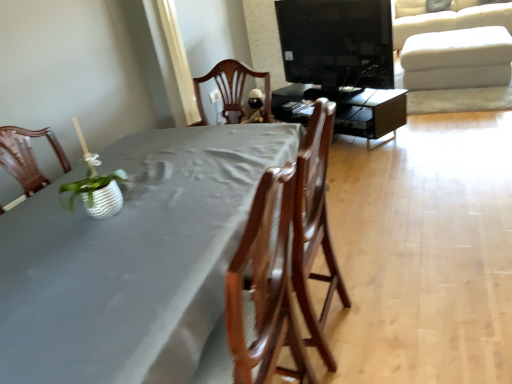
This screenshot has height=384, width=512. Describe the element at coordinates (132, 259) in the screenshot. I see `gray fabric table at center, the second table when ordered from right to left` at that location.

Describe the element at coordinates (345, 60) in the screenshot. I see `black glossy tv at upper center` at that location.

Locate an element on the screen. white textured pot at left is located at coordinates (96, 190).

Between white textured pot at left and matte black tv stand at center, the 2th table from the front, which one has less height?

white textured pot at left.

Locate an element on the screen. The width and height of the screenshot is (512, 384). table behind the white textured pot at left is located at coordinates (371, 113).

Considering the relative sizes of white textured pot at left and matte black tv stand at center, which appears as the first table when viewed from the top, in the image provided, is white textured pot at left wider than matte black tv stand at center, which appears as the first table when viewed from the top,?

In fact, white textured pot at left might be narrower than matte black tv stand at center, which appears as the first table when viewed from the top.

Would you say white textured pot at left is to the left or to the right of matte black tv stand at center, the 2th table from the front, in the picture?

From the image, it's evident that white textured pot at left is to the left of matte black tv stand at center, the 2th table from the front.

Is gray fabric table at center, the second table when ordered from right to left, with black glossy tv at upper center?

No, gray fabric table at center, the second table when ordered from right to left, is not making contact with black glossy tv at upper center.

I want to click on entertainment center above the gray fabric table at center, which is the 1th table in front-to-back order (from a real-world perspective), so click(x=345, y=60).

Which point is more distant from viewer, (x=147, y=375) or (x=326, y=42)?

The point (x=326, y=42) is more distant.

Can you confirm if wooden chair at center is positioned to the right of black glossy tv at upper center?

In fact, wooden chair at center is to the left of black glossy tv at upper center.

Where is `entertainment center behind the wooden chair at center`? entertainment center behind the wooden chair at center is located at coordinates (345, 60).

Is wooden chair at center shorter than black glossy tv at upper center?

In fact, wooden chair at center may be taller than black glossy tv at upper center.

Does point (237, 357) appear closer or farther from the camera than point (351, 114)?

Point (237, 357) appears to be closer to the viewer than point (351, 114).

Is black glossy tv at upper center positioned far away from gray fabric table at center, the first table positioned from the left?

Yes.

Is black glossy tv at upper center bigger or smaller than gray fabric table at center, the first table positioned from the left?

Considering their sizes, black glossy tv at upper center takes up less space than gray fabric table at center, the first table positioned from the left.

Which object is positioned more to the right, black glossy tv at upper center or gray fabric table at center, the first table positioned from the left?

black glossy tv at upper center is more to the right.

How much distance is there between black glossy tv at upper center and gray fabric table at center, which ranks as the 1th table in bottom-to-top order?

The distance of black glossy tv at upper center from gray fabric table at center, which ranks as the 1th table in bottom-to-top order, is 2.14 meters.

Is the depth of gray fabric table at center, the first table positioned from the left, greater than that of matte black tv stand at center, marked as the 2th table in a left-to-right arrangement?

No, it is not.

Does gray fabric table at center, which ranks as the 1th table in bottom-to-top order, turn towards matte black tv stand at center, the 2th table from the front?

No.

Can we say gray fabric table at center, the second table when ordered from right to left, lies outside matte black tv stand at center, which is counted as the second table, starting from the bottom?

That's correct, gray fabric table at center, the second table when ordered from right to left, is outside of matte black tv stand at center, which is counted as the second table, starting from the bottom.

Which point is more forward, (x=119, y=224) or (x=377, y=97)?

The point (x=119, y=224) is in front.

Is white textured pot at left not close to white fabric ottoman at upper right?

white textured pot at left is positioned a significant distance from white fabric ottoman at upper right.

In the scene shown: In terms of height, does white textured pot at left look taller or shorter compared to white fabric ottoman at upper right?

Clearly, white textured pot at left is shorter compared to white fabric ottoman at upper right.

From a real-world perspective, is white textured pot at left physically located above or below white fabric ottoman at upper right?

Clearly, from a real-world perspective, white textured pot at left is above white fabric ottoman at upper right.

From the image's perspective, between white textured pot at left and white fabric ottoman at upper right, who is located below?

From the image's view, white textured pot at left is below.

Considering the positions of objects white textured pot at left and wooden chair at center in the image provided, who is more to the left, white textured pot at left or wooden chair at center?

white textured pot at left is more to the left.

From a real-world perspective, is white textured pot at left positioned over wooden chair at center based on gravity?

Correct, in the physical world, white textured pot at left is higher than wooden chair at center.

Is white textured pot at left taller or shorter than wooden chair at center?

In the image, white textured pot at left appears to be shorter than wooden chair at center.

Image resolution: width=512 pixels, height=384 pixels. In order to click on plant in front of the matte black tv stand at center, positioned as the 1th table in right-to-left order in this screenshot , I will do `click(96, 190)`.

Find the location of a particular element. The image size is (512, 384). table on the left of black glossy tv at upper center is located at coordinates (132, 259).

Considering their positions, is wooden chair at center positioned closer to white fabric ottoman at upper right than gray fabric table at center, which ranks as the 1th table in bottom-to-top order?

wooden chair at center is positioned closer to the anchor white fabric ottoman at upper right.

Based on their spatial positions, is white fabric ottoman at upper right or white textured pot at left closer to wooden chair at center?

white textured pot at left is closer to wooden chair at center.

Looking at this image, from the image, which object appears to be nearer to white textured pot at left, white fabric ottoman at upper right or wooden chair at center?

wooden chair at center lies closer to white textured pot at left than the other object.

Which object lies further to the anchor point black glossy tv at upper center, gray fabric table at center, the second table when ordered from right to left, or wooden chair at center?

The object further to black glossy tv at upper center is gray fabric table at center, the second table when ordered from right to left.

When comparing their distances from gray fabric table at center, the second table from the top, does wooden chair at center or white textured pot at left seem closer?

white textured pot at left.

Based on their spatial positions, is white textured pot at left or gray fabric table at center, which is the 1th table in front-to-back order, closer to matte black tv stand at center, which appears as the first table when viewed from the top?

gray fabric table at center, which is the 1th table in front-to-back order, is positioned closer to the anchor matte black tv stand at center, which appears as the first table when viewed from the top.

From the image, which object appears to be nearer to black glossy tv at upper center, white fabric ottoman at upper right or white textured pot at left?

The object closer to black glossy tv at upper center is white fabric ottoman at upper right.

Estimate the real-world distances between objects in this image. Which object is further from white textured pot at left, gray fabric table at center, which ranks as the 1th table in bottom-to-top order, or wooden chair at center?

The object further to white textured pot at left is wooden chair at center.

I want to click on plant between wooden chair at center and white fabric ottoman at upper right along the z-axis, so click(x=96, y=190).

Find the location of `entertainment center between gray fabric table at center, the second table when ordered from right to left, and matte black tv stand at center, marked as the 2th table in a left-to-right arrangement, along the z-axis`. entertainment center between gray fabric table at center, the second table when ordered from right to left, and matte black tv stand at center, marked as the 2th table in a left-to-right arrangement, along the z-axis is located at coordinates (345, 60).

The height and width of the screenshot is (384, 512). In order to click on plant located between gray fabric table at center, which ranks as the 1th table in bottom-to-top order, and black glossy tv at upper center in the depth direction in this screenshot , I will do `click(96, 190)`.

This screenshot has height=384, width=512. Find the location of `plant positioned between gray fabric table at center, the second table viewed from the back, and matte black tv stand at center, which is counted as the second table, starting from the bottom, from near to far`. plant positioned between gray fabric table at center, the second table viewed from the back, and matte black tv stand at center, which is counted as the second table, starting from the bottom, from near to far is located at coordinates (96, 190).